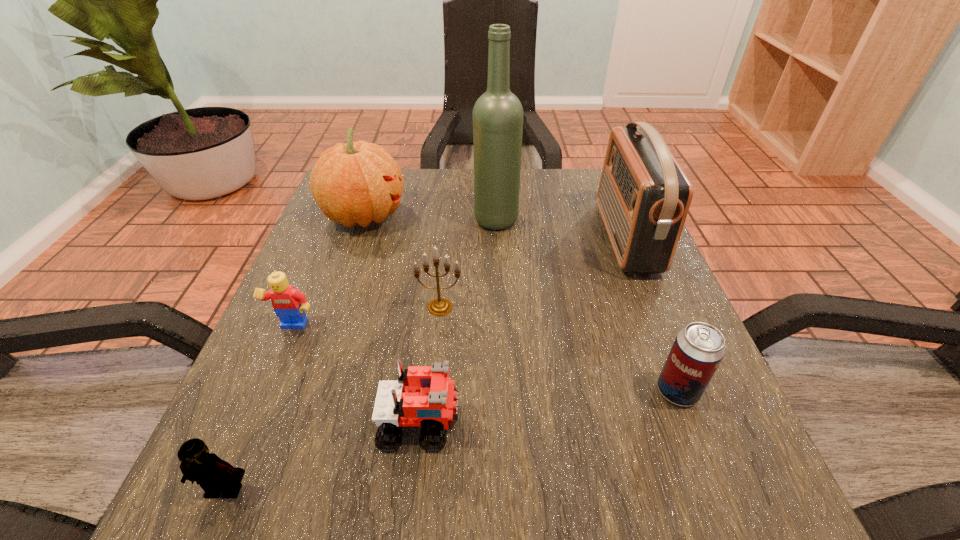
Identify the location of the tallest object. This screenshot has height=540, width=960. (498, 115).

The image size is (960, 540). What are the coordinates of `wine bottle` in the screenshot? It's located at (498, 115).

Identify the location of radio receiver. The height and width of the screenshot is (540, 960). (644, 196).

Locate an element on the screen. The image size is (960, 540). pumpkin is located at coordinates (354, 183).

This screenshot has width=960, height=540. Identify the location of the fourth farthest object. 439,306.

I want to click on beer can, so click(699, 348).

In order to click on the farthest Lego in this screenshot , I will do `click(288, 303)`.

I want to click on the rightmost Lego, so click(424, 396).

I want to click on the nearest Lego, so click(215, 476).

This screenshot has height=540, width=960. In order to click on free space located on the front of the wine bottle in this screenshot , I will do `click(498, 265)`.